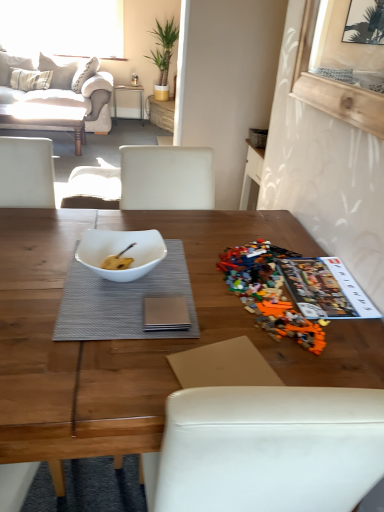
What are the coordinates of `free location to the left of gray textured placemat at center` in the screenshot? It's located at (31, 264).